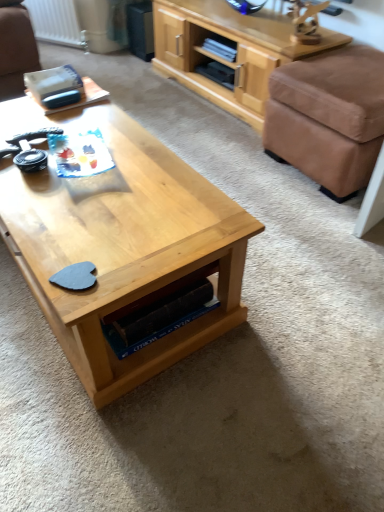
In order to face light wood cabinet at upper right, should I rotate leftwards or rightwards?

You should rotate right by 6.157 degrees.

Locate an element on the screen. The height and width of the screenshot is (512, 384). light wood cabinet at upper right is located at coordinates (237, 53).

Is light wood coffee table at center positioned beyond the bounds of brown fabric ottoman at right?

Yes, light wood coffee table at center is located beyond the bounds of brown fabric ottoman at right.

Considering the positions of point (100, 177) and point (368, 113), is point (100, 177) closer or farther from the camera than point (368, 113)?

Clearly, point (100, 177) is closer to the camera than point (368, 113).

From a real-world perspective, is light wood coffee table at center physically located above or below brown fabric ottoman at right?

Clearly, from a real-world perspective, light wood coffee table at center is below brown fabric ottoman at right.

Based on the photo, how different are the orientations of light wood coffee table at center and brown fabric ottoman at right in degrees?

The angle between the facing direction of light wood coffee table at center and the facing direction of brown fabric ottoman at right is 179 degrees.

Is white painted metal radiator at upper left positioned before brown fabric ottoman at right?

No, it is behind brown fabric ottoman at right.

How different are the orientations of white painted metal radiator at upper left and brown fabric ottoman at right in degrees?

The facing directions of white painted metal radiator at upper left and brown fabric ottoman at right are 30.3 degrees apart.

Is white painted metal radiator at upper left directly adjacent to brown fabric ottoman at right?

No, white painted metal radiator at upper left is not beside brown fabric ottoman at right.

From a real-world perspective, is white painted metal radiator at upper left physically above brown fabric ottoman at right?

Incorrect, from a real-world perspective, white painted metal radiator at upper left is lower than brown fabric ottoman at right.

In the scene shown: Is white painted metal radiator at upper left not within light wood cabinet at upper right?

Indeed, white painted metal radiator at upper left is completely outside light wood cabinet at upper right.

From the image's perspective, between white painted metal radiator at upper left and light wood cabinet at upper right, who is located below?

From the image's view, light wood cabinet at upper right is below.

This screenshot has height=512, width=384. Identify the location of shelf that appears in front of the white painted metal radiator at upper left. (237, 53).

Which is more to the right, brown fabric ottoman at right or light wood coffee table at center?

Positioned to the right is brown fabric ottoman at right.

Could you tell me if brown fabric ottoman at right is facing light wood coffee table at center?

Yes.

Would you say brown fabric ottoman at right is outside light wood coffee table at center?

Absolutely, brown fabric ottoman at right is external to light wood coffee table at center.

From the image's perspective, between light wood coffee table at center and light wood cabinet at upper right, which one is located above?

light wood cabinet at upper right appears higher in the image.

Which of these two, light wood coffee table at center or light wood cabinet at upper right, is bigger?

Bigger between the two is light wood cabinet at upper right.

Where is `shelf lying on the right of light wood coffee table at center`? This screenshot has width=384, height=512. shelf lying on the right of light wood coffee table at center is located at coordinates (237, 53).

Considering the sizes of light wood coffee table at center and light wood cabinet at upper right in the image, is light wood coffee table at center taller or shorter than light wood cabinet at upper right?

Clearly, light wood coffee table at center is shorter compared to light wood cabinet at upper right.

Find the location of a particular element. Image resolution: width=384 pixels, height=512 pixels. shelf above the light wood coffee table at center (from a real-world perspective) is located at coordinates (237, 53).

Between light wood cabinet at upper right and light wood coffee table at center, which one has larger size?

light wood cabinet at upper right is bigger.

Is light wood cabinet at upper right wider than light wood coffee table at center?

No, light wood cabinet at upper right is not wider than light wood coffee table at center.

Is light wood coffee table at center at the right side of white painted metal radiator at upper left?

Yes, light wood coffee table at center is to the right of white painted metal radiator at upper left.

Would you say light wood coffee table at center is a long distance from white painted metal radiator at upper left?

Absolutely, light wood coffee table at center is distant from white painted metal radiator at upper left.

Does light wood coffee table at center have a larger size compared to white painted metal radiator at upper left?

Yes, light wood coffee table at center is bigger than white painted metal radiator at upper left.

The image size is (384, 512). I want to click on stool that appears on the right of light wood coffee table at center, so click(328, 118).

Image resolution: width=384 pixels, height=512 pixels. I want to click on radiator behind the brown fabric ottoman at right, so click(x=56, y=22).

Based on the photo, which object lies further to the anchor point white painted metal radiator at upper left, light wood cabinet at upper right or brown fabric ottoman at right?

brown fabric ottoman at right is positioned further to the anchor white painted metal radiator at upper left.

Looking at the image, which one is located further to light wood cabinet at upper right, white painted metal radiator at upper left or brown fabric ottoman at right?

A: Among the two, white painted metal radiator at upper left is located further to light wood cabinet at upper right.

Based on their spatial positions, is light wood coffee table at center or white painted metal radiator at upper left closer to light wood cabinet at upper right?

white painted metal radiator at upper left lies closer to light wood cabinet at upper right than the other object.

Looking at the image, which one is located further to light wood cabinet at upper right, white painted metal radiator at upper left or light wood coffee table at center?

light wood coffee table at center is further to light wood cabinet at upper right.

Looking at the image, which one is located closer to white painted metal radiator at upper left, light wood coffee table at center or brown fabric ottoman at right?

Among the two, brown fabric ottoman at right is located nearer to white painted metal radiator at upper left.

Based on their spatial positions, is brown fabric ottoman at right or light wood coffee table at center closer to white painted metal radiator at upper left?

brown fabric ottoman at right is positioned closer to the anchor white painted metal radiator at upper left.

Looking at the image, which one is located closer to white painted metal radiator at upper left, light wood coffee table at center or light wood cabinet at upper right?

light wood cabinet at upper right.

In the scene shown: From the image, which object appears to be nearer to light wood coffee table at center, brown fabric ottoman at right or white painted metal radiator at upper left?

brown fabric ottoman at right.

Find the location of a particular element. shelf between light wood coffee table at center and white painted metal radiator at upper left from front to back is located at coordinates (237, 53).

Where is `stool positioned between light wood coffee table at center and white painted metal radiator at upper left from near to far`? The image size is (384, 512). stool positioned between light wood coffee table at center and white painted metal radiator at upper left from near to far is located at coordinates (328, 118).

At what (x,y) coordinates should I click in order to perform the action: click on shelf situated between white painted metal radiator at upper left and brown fabric ottoman at right from left to right. Please return your answer as a coordinate pair (x, y). Looking at the image, I should click on (237, 53).

The image size is (384, 512). Find the location of `shelf between light wood coffee table at center and brown fabric ottoman at right`. shelf between light wood coffee table at center and brown fabric ottoman at right is located at coordinates (237, 53).